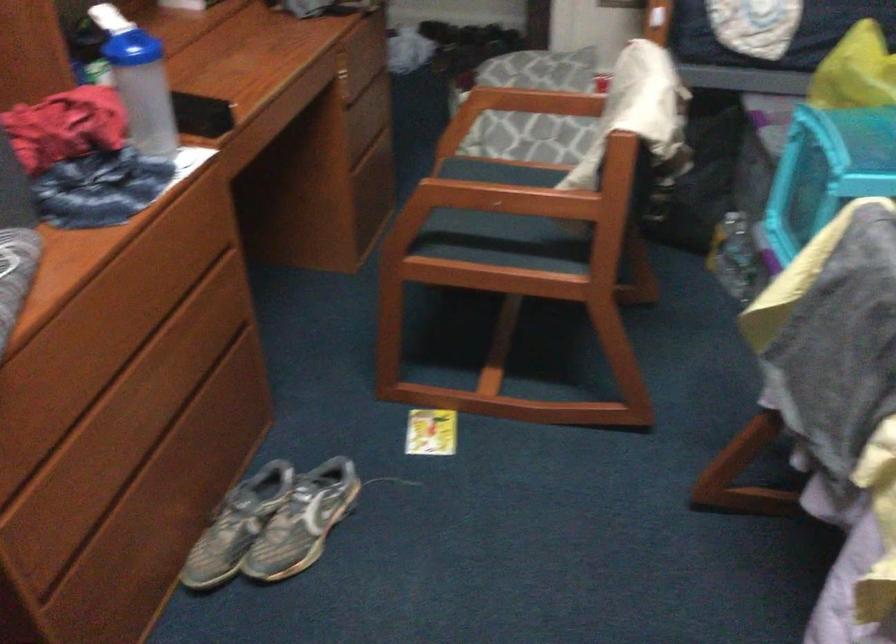
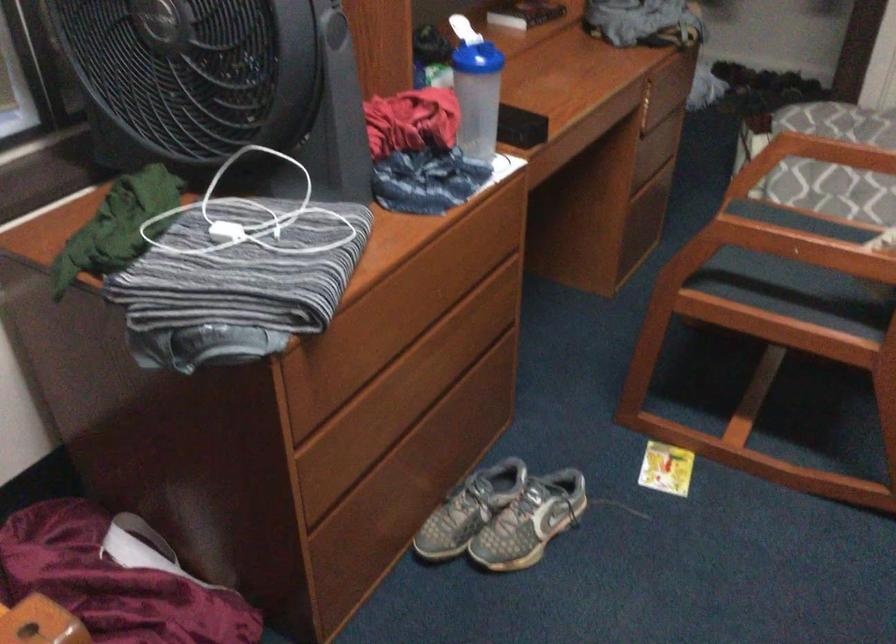
In the second image, find the point that corresponds to [429,433] in the first image.

(666, 468)